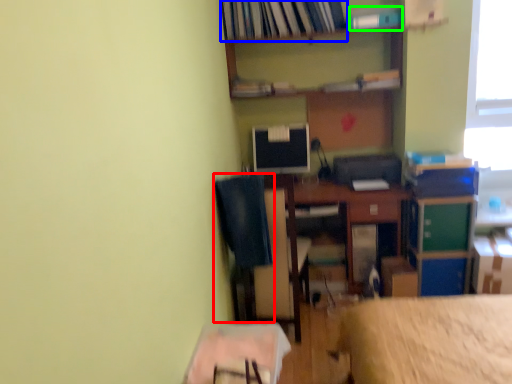
Question: Which is farther away from computer chair (highlighted by a red box)? book (highlighted by a blue box) or book (highlighted by a green box)?

Choices:
 (A) book
 (B) book

Answer: (B)